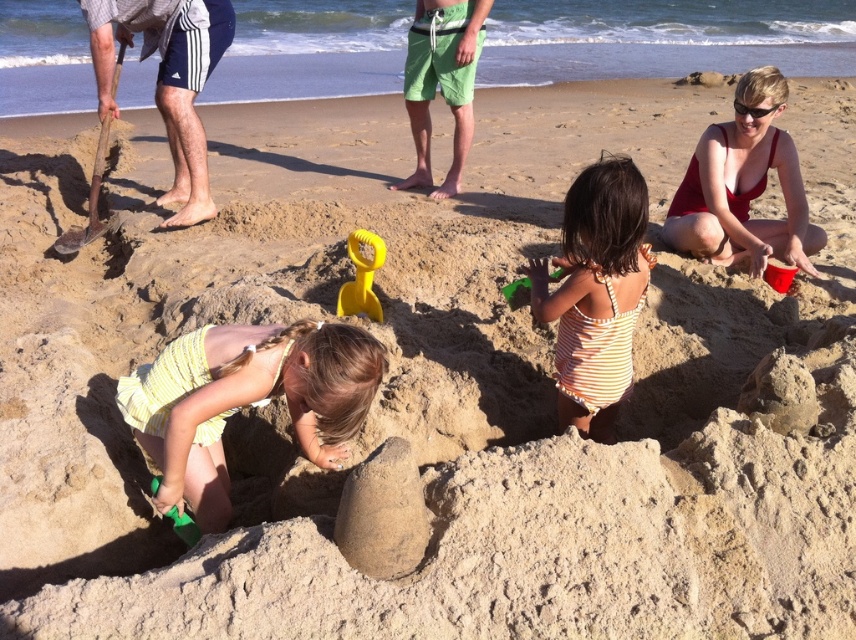
From the picture: Does green cotton shorts at center have a larger size compared to red plastic bucket at lower right?

Indeed, green cotton shorts at center has a larger size compared to red plastic bucket at lower right.

Is point (480, 36) positioned before point (783, 289)?

No.

Describe the element at coordinates (441, 81) in the screenshot. I see `green cotton shorts at center` at that location.

Identify the location of green cotton shorts at center. (441, 81).

Is striped cotton swimsuit at center above red plastic bucket at lower right?

Actually, striped cotton swimsuit at center is below red plastic bucket at lower right.

Is striped cotton swimsuit at center shorter than red plastic bucket at lower right?

Incorrect, striped cotton swimsuit at center's height does not fall short of red plastic bucket at lower right's.

The height and width of the screenshot is (640, 856). Identify the location of striped cotton swimsuit at center. (596, 292).

Does dark blue shorts at left have a greater height compared to red plastic bucket at lower right?

Yes.

Which is in front, point (226, 12) or point (782, 289)?

Positioned in front is point (782, 289).

What do you see at coordinates (168, 80) in the screenshot?
I see `dark blue shorts at left` at bounding box center [168, 80].

You are a GUI agent. You are given a task and a screenshot of the screen. Output one action in this format:
    pyautogui.click(x=<x>, y=<y>)
    Task: Click on the dark blue shorts at left
    Image resolution: width=856 pixels, height=640 pixels.
    Given the screenshot: What is the action you would take?
    pyautogui.click(x=168, y=80)